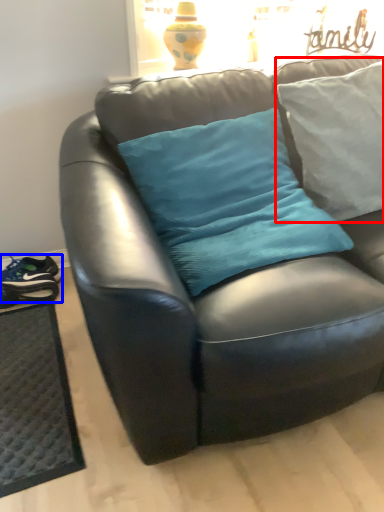
Question: Which object is further to the camera taking this photo, pillow (highlighted by a red box) or footwear (highlighted by a blue box)?

Choices:
 (A) pillow
 (B) footwear

Answer: (B)